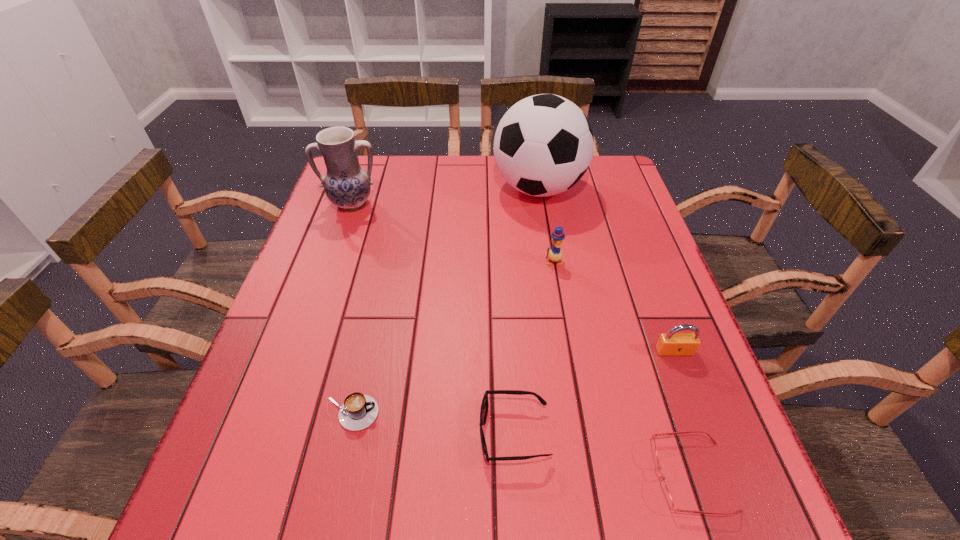
Where is `object at the near right corner`? This screenshot has width=960, height=540. object at the near right corner is located at coordinates (666, 494).

I want to click on vacant space at the far edge of the desktop, so click(497, 197).

In the image, there is a desktop. In order to click on free space at the near edge in this screenshot , I will do `click(488, 523)`.

Locate an element on the screen. blank area at the left edge is located at coordinates (348, 269).

Image resolution: width=960 pixels, height=540 pixels. In order to click on free space at the right edge of the desktop in this screenshot , I will do click(620, 225).

In the image, there is a desktop. Identify the location of free space at the far right corner. This screenshot has width=960, height=540. (621, 179).

Identify the location of vacant space at the near right corner of the desktop. (669, 487).

Identify the location of free spot between the sixth shortest object and the cappuccino. Image resolution: width=960 pixels, height=540 pixels. (352, 309).

Locate an element on the screen. vacant space in between the tallest object and the sunglasses is located at coordinates (526, 311).

Identify the location of free space between the second tallest object and the third farthest object. (453, 233).